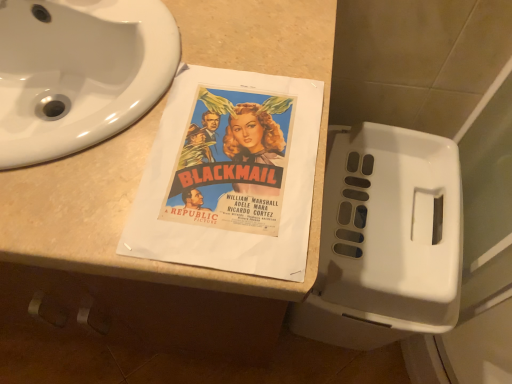
Question: Is white glossy sink at upper left smaller than white plastic toilet at right?

Choices:
 (A) yes
 (B) no

Answer: (A)

Question: Is white glossy sink at upper left outside white plastic toilet at right?

Choices:
 (A) yes
 (B) no

Answer: (A)

Question: Is white glossy sink at upper left looking in the opposite direction of white plastic toilet at right?

Choices:
 (A) no
 (B) yes

Answer: (A)

Question: Is white glossy sink at upper left far from white plastic toilet at right?

Choices:
 (A) yes
 (B) no

Answer: (B)

Question: From a real-world perspective, is white glossy sink at upper left on white plastic toilet at right?

Choices:
 (A) no
 (B) yes

Answer: (B)

Question: Is point (88, 178) positioned closer to the camera than point (103, 54)?

Choices:
 (A) farther
 (B) closer

Answer: (B)

Question: Do you think beige laminate counter top at center is within white glossy sink at upper left, or outside of it?

Choices:
 (A) outside
 (B) inside

Answer: (A)

Question: From the image's perspective, is beige laminate counter top at center located above or below white glossy sink at upper left?

Choices:
 (A) below
 (B) above

Answer: (A)

Question: In terms of size, does beige laminate counter top at center appear bigger or smaller than white glossy sink at upper left?

Choices:
 (A) big
 (B) small

Answer: (A)

Question: Is white plastic toilet at right bigger or smaller than white glossy sink at upper left?

Choices:
 (A) big
 (B) small

Answer: (A)

Question: Is white plastic toilet at right situated inside white glossy sink at upper left or outside?

Choices:
 (A) outside
 (B) inside

Answer: (A)

Question: Is white plastic toilet at right in front of or behind white glossy sink at upper left in the image?

Choices:
 (A) behind
 (B) front

Answer: (A)

Question: Is white plastic toilet at right taller or shorter than white glossy sink at upper left?

Choices:
 (A) tall
 (B) short

Answer: (A)

Question: Considering their positions, is white plastic toilet at right located in front of or behind beige laminate counter top at center?

Choices:
 (A) behind
 (B) front

Answer: (A)

Question: In terms of size, does white plastic toilet at right appear bigger or smaller than beige laminate counter top at center?

Choices:
 (A) small
 (B) big

Answer: (A)